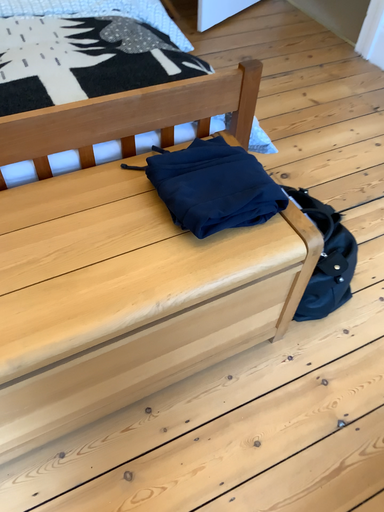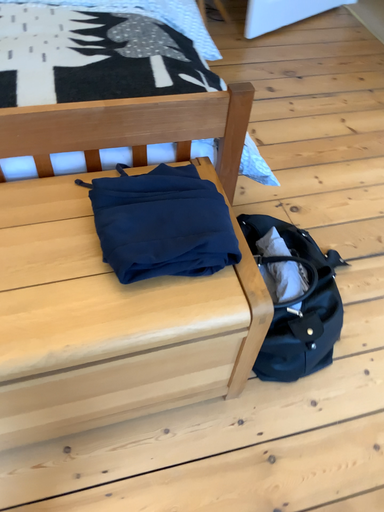
Question: Which way did the camera rotate in the video?

Choices:
 (A) rotated left
 (B) rotated right

Answer: (A)